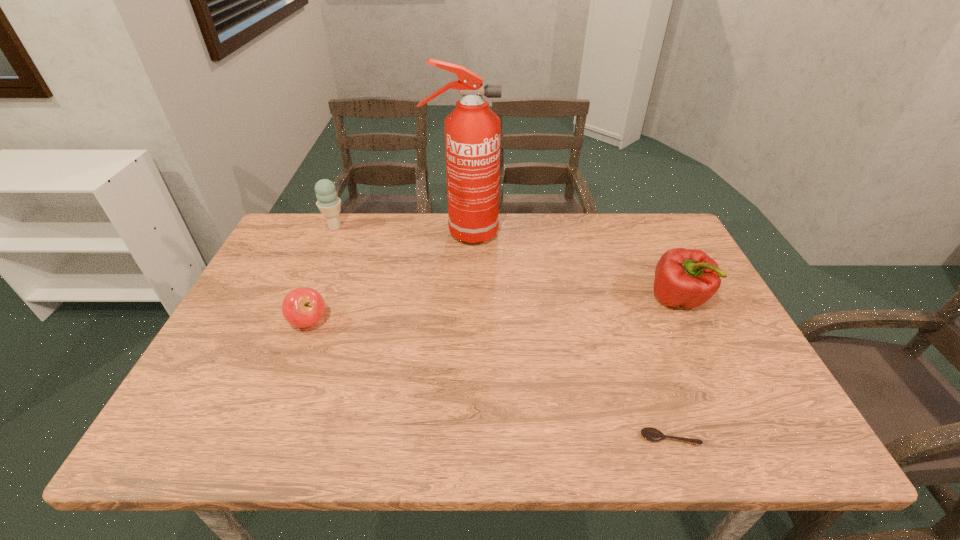
Locate an element on the screen. Image resolution: width=960 pixels, height=540 pixels. vacant space that's between the ice cream and the rightmost object is located at coordinates (506, 264).

Find the location of `free spot between the soupspoon and the apple`. free spot between the soupspoon and the apple is located at coordinates (490, 380).

Identify the location of vacant space that is in between the second object from right to left and the third object from right to left. This screenshot has height=540, width=960. (566, 336).

This screenshot has width=960, height=540. What are the coordinates of `empty space that is in between the ice cream and the fourth tallest object` in the screenshot? It's located at (322, 274).

Where is `free area in between the ice cream and the fourth tallest object`? Image resolution: width=960 pixels, height=540 pixels. free area in between the ice cream and the fourth tallest object is located at coordinates [x=322, y=274].

The image size is (960, 540). I want to click on vacant point located between the shortest object and the apple, so [x=490, y=380].

Locate an element on the screen. object that stands as the fourth closest to the ice cream is located at coordinates (652, 434).

Where is `the second closest object to the apple`? This screenshot has height=540, width=960. the second closest object to the apple is located at coordinates tap(472, 130).

What are the coordinates of `free location that satisfies the following two spatial constraints: 1. at the nozzle of the rightmost object; 2. on the right side of the tallest object` in the screenshot? It's located at (460, 300).